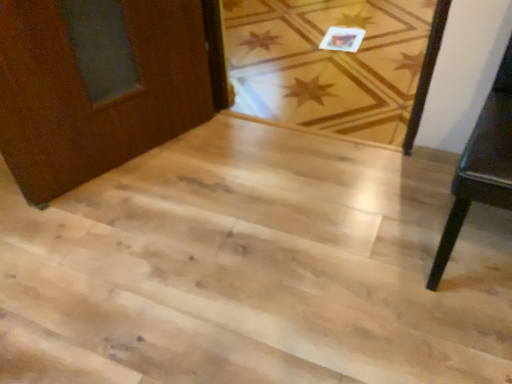
At what (x,y) coordinates should I click in order to perform the action: click on free space underneath dark wood table at right (from a real-world perspective). Please return your answer as a coordinate pair (x, y). Looking at the image, I should click on (474, 248).